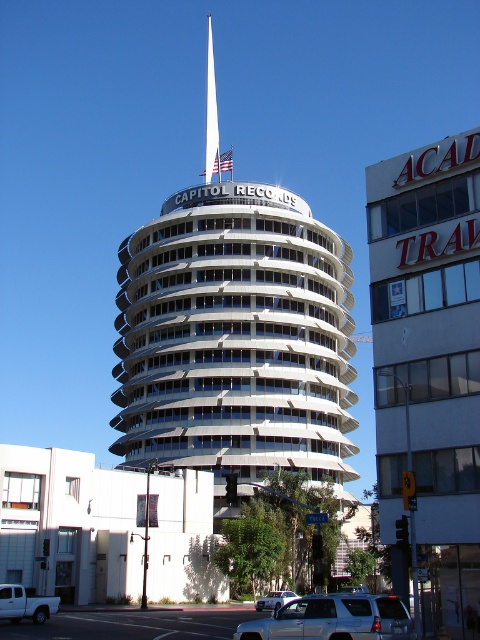
In the scene shown: You are a photographer planning to capture the Capitol Records Building with both silver metallic suv at lower center and silver metallic suv at center in the frame. Which silver metallic suv appears bigger in your photo?

The silver metallic suv at lower center appears bigger in the photo because it is larger in size than the silver metallic suv at center.

You are standing in front of the Capitol Records Building and see a silver metallic suv at lower center. There is a point marked at coordinate [333,620]. Where is this point located?

The point at coordinate [333,620] is located on the silver metallic suv at lower center.

You are standing in front of the Capitol Records Building and notice two points marked on the flagpole. The first point is at coordinate point (316,605) and the second is at point (32,605). Which point is closer to your current position?

Point (316,605) is closer to the camera than point (32,605), so the first point is closer to your current position.